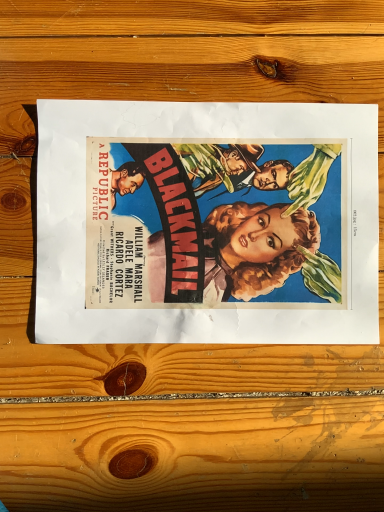
I want to click on matte paper poster at center, so tap(194, 138).

Describe the element at coordinates (194, 138) in the screenshot. This screenshot has width=384, height=512. I see `matte paper poster at center` at that location.

Find the location of a particular element. The width and height of the screenshot is (384, 512). matte paper poster at center is located at coordinates (194, 138).